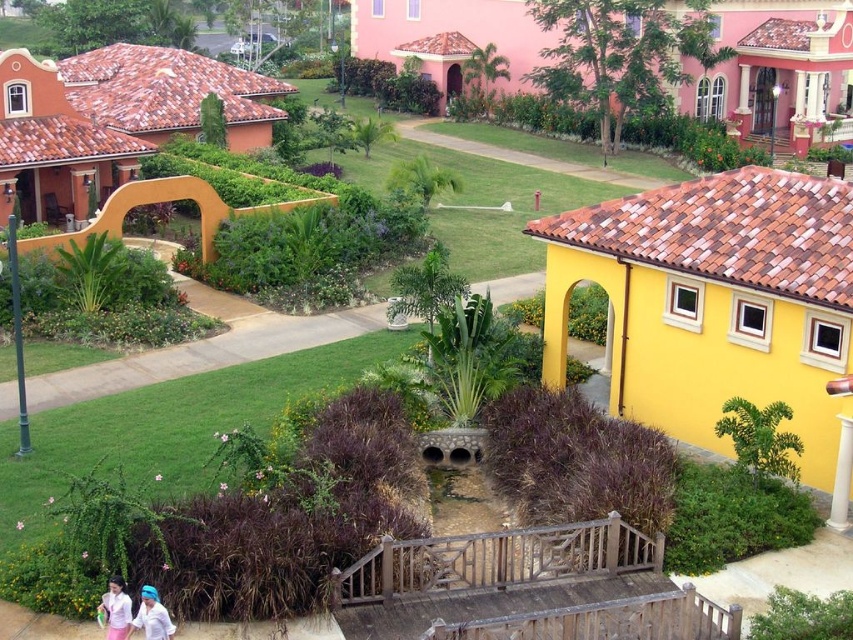
Question: Is pink fabric dress at lower left positioned in front of white matte shirt at lower left?

Choices:
 (A) no
 (B) yes

Answer: (A)

Question: Which point is closer to the camera taking this photo?

Choices:
 (A) (111, 625)
 (B) (136, 625)

Answer: (A)

Question: Which object appears closest to the camera in this image?

Choices:
 (A) white matte shirt at lower left
 (B) pink fabric dress at lower left

Answer: (A)

Question: Which point is farther from the camera taking this photo?

Choices:
 (A) pos(166,620)
 (B) pos(126,620)

Answer: (B)

Question: From the image, what is the correct spatial relationship of pink fabric dress at lower left in relation to white matte shirt at lower left?

Choices:
 (A) above
 (B) below

Answer: (B)

Question: Can you confirm if pink fabric dress at lower left is smaller than white matte shirt at lower left?

Choices:
 (A) no
 (B) yes

Answer: (A)